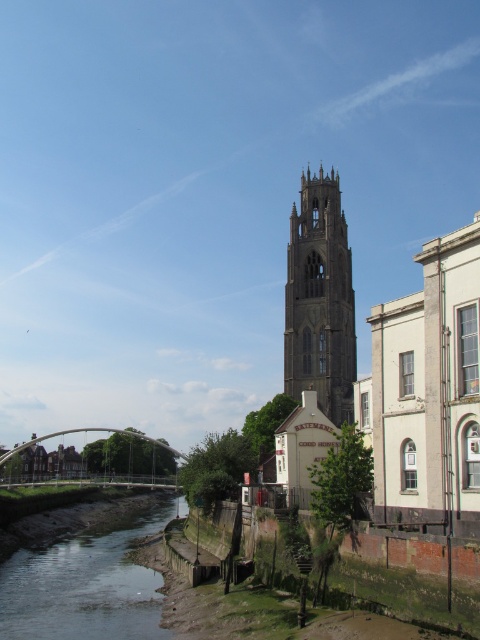
Question: Does clear water at lower left have a larger size compared to stone gothic tower at center?

Choices:
 (A) yes
 (B) no

Answer: (A)

Question: Which of the following is the farthest from the observer?

Choices:
 (A) (84, 564)
 (B) (143, 438)
 (C) (337, 426)

Answer: (B)

Question: Which point appears closest to the camera in this image?

Choices:
 (A) (x=370, y=317)
 (B) (x=159, y=522)

Answer: (A)

Question: Considering the relative positions of clear water at lower left and stone gothic tower at center in the image provided, where is clear water at lower left located with respect to stone gothic tower at center?

Choices:
 (A) below
 (B) above

Answer: (A)

Question: Where is clear water at lower left located in relation to stone gothic tower at center in the image?

Choices:
 (A) above
 (B) below

Answer: (B)

Question: Based on their relative distances, which object is nearer to the white smooth building at center?

Choices:
 (A) clear water at lower left
 (B) stone gothic tower at center

Answer: (A)